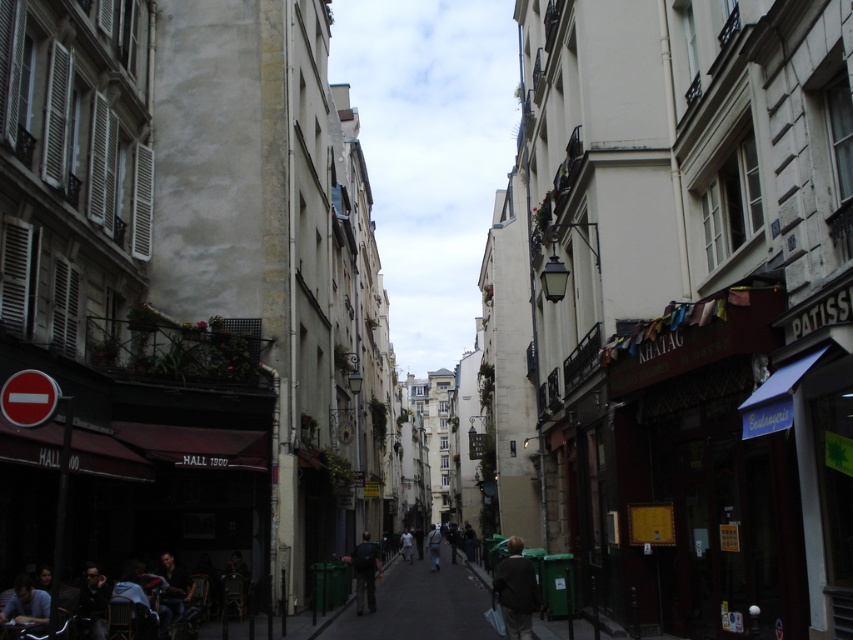
Question: Is dark brown leather jacket at center positioned behind dark blue jeans at lower left?

Choices:
 (A) yes
 (B) no

Answer: (B)

Question: Can you confirm if dark blue jeans at lower left is positioned above white matte person at center?

Choices:
 (A) yes
 (B) no

Answer: (A)

Question: Which of these objects is positioned farthest from the dark brown leather jacket at lower left?

Choices:
 (A) dark blue jeans at lower left
 (B) white matte person at center

Answer: (B)

Question: Which point is closer to the camera?

Choices:
 (A) (358, 544)
 (B) (430, 528)

Answer: (A)

Question: Can you confirm if green plastic trash can at center is smaller than dark blue jeans at lower left?

Choices:
 (A) yes
 (B) no

Answer: (B)

Question: Which object is closer to the camera taking this photo?

Choices:
 (A) white matte person at center
 (B) light gray fabric jacket at center

Answer: (B)